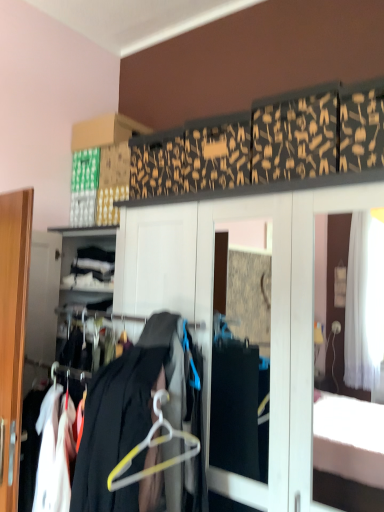
Question: From the image's perspective, is white plastic hanger at center located above black fabric coat at center?

Choices:
 (A) no
 (B) yes

Answer: (B)

Question: Is white plastic hanger at center bigger than black fabric coat at center?

Choices:
 (A) yes
 (B) no

Answer: (B)

Question: Is white plastic hanger at center oriented towards black fabric coat at center?

Choices:
 (A) yes
 (B) no

Answer: (A)

Question: Is black fabric coat at center surrounded by white plastic hanger at center?

Choices:
 (A) yes
 (B) no

Answer: (B)

Question: Does white plastic hanger at center have a lesser width compared to black fabric coat at center?

Choices:
 (A) yes
 (B) no

Answer: (A)

Question: From a real-world perspective, is white plastic hanger at center on top of black fabric coat at center?

Choices:
 (A) yes
 (B) no

Answer: (A)

Question: Is black fabric coat at center far away from white plastic hanger at center?

Choices:
 (A) no
 (B) yes

Answer: (A)

Question: Does black fabric coat at center lie in front of white plastic hanger at center?

Choices:
 (A) no
 (B) yes

Answer: (B)

Question: Considering the relative positions of black fabric coat at center and white plastic hanger at center in the image provided, is black fabric coat at center to the right of white plastic hanger at center from the viewer's perspective?

Choices:
 (A) no
 (B) yes

Answer: (A)

Question: Is black fabric coat at center with white plastic hanger at center?

Choices:
 (A) yes
 (B) no

Answer: (A)

Question: From the image's perspective, is black fabric coat at center beneath white plastic hanger at center?

Choices:
 (A) no
 (B) yes

Answer: (B)

Question: Can you confirm if black fabric coat at center is smaller than white plastic hanger at center?

Choices:
 (A) yes
 (B) no

Answer: (B)

Question: From a real-world perspective, is black fabric coat at center physically located above or below white plastic hanger at center?

Choices:
 (A) below
 (B) above

Answer: (A)